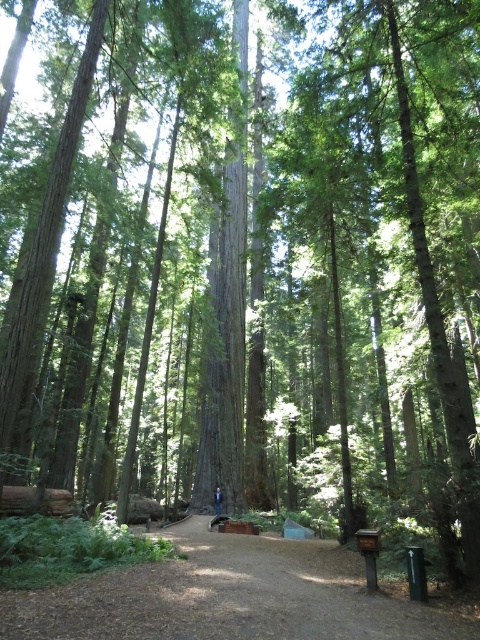
Question: Among these objects, which one is nearest to the camera?

Choices:
 (A) brown dirt path at center
 (B) blue jeans at center

Answer: (A)

Question: Can you confirm if brown dirt path at center is positioned below blue jeans at center?

Choices:
 (A) yes
 (B) no

Answer: (B)

Question: Observing the image, what is the correct spatial positioning of brown dirt path at center in reference to blue jeans at center?

Choices:
 (A) below
 (B) above

Answer: (B)

Question: Does brown dirt path at center appear under blue jeans at center?

Choices:
 (A) no
 (B) yes

Answer: (A)

Question: Which point is farther to the camera?

Choices:
 (A) click(268, 556)
 (B) click(218, 504)

Answer: (B)